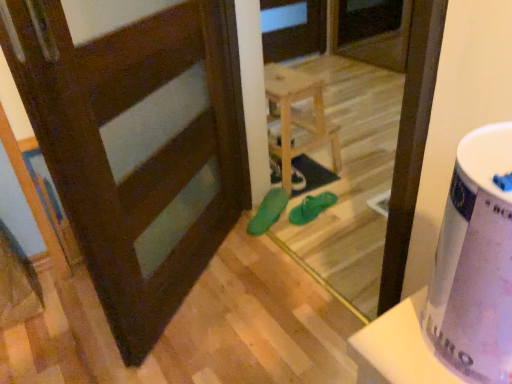
You are a GUI agent. You are given a task and a screenshot of the screen. Output one action in this format:
    pyautogui.click(x=<x>, y=<y>)
    Task: Click on the green rubber sandals at center, marked as the second footwear in a right-to-left arrangement
    
    Given the screenshot: What is the action you would take?
    pyautogui.click(x=268, y=211)

Locate an element on the screen. The width and height of the screenshot is (512, 384). green rubber sandals at center is located at coordinates (371, 169).

What are the coordinates of `dark brown wood door at center` in the screenshot? It's located at (145, 157).

What is the approximate height of matte green shoe at center?

matte green shoe at center is 2.54 inches in height.

I want to click on matte green shoe at center, so click(275, 170).

Locate an element on the screen. The height and width of the screenshot is (384, 512). green rubber sandals at center, marked as the second footwear in a right-to-left arrangement is located at coordinates (268, 211).

Does green rubber sandals at center, arranged as the 1th footwear when viewed from the left, lie in front of light wood stool at center?

That is True.

Is green rubber sandals at center, marked as the second footwear in a right-to-left arrangement, turned away from light wood stool at center?

green rubber sandals at center, marked as the second footwear in a right-to-left arrangement, does not have its back to light wood stool at center.

Considering the sizes of green rubber sandals at center, marked as the second footwear in a right-to-left arrangement, and light wood stool at center in the image, is green rubber sandals at center, marked as the second footwear in a right-to-left arrangement, wider or thinner than light wood stool at center?

green rubber sandals at center, marked as the second footwear in a right-to-left arrangement, is thinner than light wood stool at center.

How much distance is there between green rubber sandals at center, arranged as the 1th footwear when viewed from the left, and light wood stool at center?

12.32 inches.

Between green rubber sandals at center and light wood stool at center, which one has larger width?

light wood stool at center.

From a real-world perspective, which object stands above the other?

In real-world perspective, green rubber sandals at center is above.

Is green rubber sandals at center facing away from light wood stool at center?

green rubber sandals at center is not turned away from light wood stool at center.

Locate an element on the screen. furniture behind the green rubber sandals at center is located at coordinates (298, 117).

I want to click on shoe on the left of green rubber flip-flops at center, which is the first footwear from right to left, so click(x=275, y=170).

Can you tell me how much green rubber flip-flops at center, which is counted as the 2th footwear, starting from the left, and matte green shoe at center differ in facing direction?

24.9 degrees.

Is green rubber flip-flops at center, which is the first footwear from right to left, facing towards matte green shoe at center?

No, green rubber flip-flops at center, which is the first footwear from right to left, is not turned towards matte green shoe at center.

Is point (298, 222) positioned after point (301, 180)?

No.

Considering the positions of point (66, 135) and point (307, 193), is point (66, 135) closer or farther from the camera than point (307, 193)?

Clearly, point (66, 135) is closer to the camera than point (307, 193).

Considering the sizes of objects dark brown wood door at center and green rubber sandals at center in the image provided, who is wider, dark brown wood door at center or green rubber sandals at center?

Wider between the two is dark brown wood door at center.

Is dark brown wood door at center positioned far away from green rubber sandals at center?

Actually, dark brown wood door at center and green rubber sandals at center are a little close together.

How different are the orientations of dark brown wood door at center and green rubber sandals at center in degrees?

125 degrees.

The height and width of the screenshot is (384, 512). Find the location of `the 2nd footwear to the right of the dark brown wood door at center, starting your count from the anchor`. the 2nd footwear to the right of the dark brown wood door at center, starting your count from the anchor is located at coordinates (311, 208).

Considering the relative sizes of dark brown wood door at center and green rubber flip-flops at center, which is counted as the 2th footwear, starting from the left, in the image provided, is dark brown wood door at center smaller than green rubber flip-flops at center, which is counted as the 2th footwear, starting from the left,?

A: No, dark brown wood door at center is not smaller than green rubber flip-flops at center, which is counted as the 2th footwear, starting from the left.

Is dark brown wood door at center looking in the opposite direction of green rubber flip-flops at center, which is the first footwear from right to left?

No, dark brown wood door at center is not facing the opposite direction of green rubber flip-flops at center, which is the first footwear from right to left.

Is green rubber flip-flops at center, which is the first footwear from right to left, completely or partially inside dark brown wood door at center?

Definitely not — green rubber flip-flops at center, which is the first footwear from right to left, is not inside dark brown wood door at center.

Is green rubber sandals at center facing away from green rubber sandals at center, arranged as the 1th footwear when viewed from the left?

Yes, green rubber sandals at center is positioned with its back facing green rubber sandals at center, arranged as the 1th footwear when viewed from the left.

Considering the relative sizes of green rubber sandals at center and green rubber sandals at center, arranged as the 1th footwear when viewed from the left, in the image provided, is green rubber sandals at center shorter than green rubber sandals at center, arranged as the 1th footwear when viewed from the left,?

Incorrect, the height of green rubber sandals at center does not fall short of that of green rubber sandals at center, arranged as the 1th footwear when viewed from the left.

Are green rubber sandals at center and green rubber sandals at center, arranged as the 1th footwear when viewed from the left, beside each other?

No, green rubber sandals at center is not with green rubber sandals at center, arranged as the 1th footwear when viewed from the left.

Which is in front, point (360, 202) or point (262, 224)?

The point (262, 224) is closer to the camera.

Considering the positions of objects green rubber flip-flops at center, which is counted as the 2th footwear, starting from the left, and white glossy potty at right in the image provided, who is more to the right, green rubber flip-flops at center, which is counted as the 2th footwear, starting from the left, or white glossy potty at right?

From the viewer's perspective, green rubber flip-flops at center, which is counted as the 2th footwear, starting from the left, appears more on the right side.

Considering the points (312, 214) and (466, 377), which point is in front, point (312, 214) or point (466, 377)?

Point (466, 377)

In the image, there is a white glossy potty at right. Identify the location of footwear above it (from the image's perspective). The height and width of the screenshot is (384, 512). (311, 208).

Where is `furniture above the green rubber sandals at center, marked as the second footwear in a right-to-left arrangement (from the image's perspective)`? Image resolution: width=512 pixels, height=384 pixels. furniture above the green rubber sandals at center, marked as the second footwear in a right-to-left arrangement (from the image's perspective) is located at coordinates (298, 117).

Locate an element on the screen. Image resolution: width=512 pixels, height=384 pixels. screen door below the light wood stool at center (from the image's perspective) is located at coordinates (371, 169).

Estimate the real-world distances between objects in this image. Which object is further from white glossy potty at right, green rubber flip-flops at center, which is counted as the 2th footwear, starting from the left, or green rubber sandals at center, arranged as the 1th footwear when viewed from the left?

green rubber flip-flops at center, which is counted as the 2th footwear, starting from the left, lies further to white glossy potty at right than the other object.

Estimate the real-world distances between objects in this image. Which object is further from light wood stool at center, white glossy potty at right or green rubber flip-flops at center, which is the first footwear from right to left?

Based on the image, white glossy potty at right appears to be further to light wood stool at center.

When comparing their distances from light wood stool at center, does dark brown wood door at center or green rubber sandals at center seem closer?

green rubber sandals at center is closer to light wood stool at center.

Which object lies further to the anchor point green rubber flip-flops at center, which is the first footwear from right to left, green rubber sandals at center, arranged as the 1th footwear when viewed from the left, or dark brown wood door at center?

The object further to green rubber flip-flops at center, which is the first footwear from right to left, is dark brown wood door at center.

From the picture: From the image, which object appears to be farther from light wood stool at center, green rubber sandals at center, arranged as the 1th footwear when viewed from the left, or white glossy potty at right?

Based on the image, white glossy potty at right appears to be further to light wood stool at center.

Looking at the image, which one is located further to white glossy potty at right, light wood stool at center or green rubber flip-flops at center, which is the first footwear from right to left?

light wood stool at center lies further to white glossy potty at right than the other object.

Based on their spatial positions, is matte green shoe at center or dark brown wood door at center further from light wood stool at center?

Based on the image, dark brown wood door at center appears to be further to light wood stool at center.

From the image, which object appears to be nearer to light wood stool at center, green rubber sandals at center, marked as the second footwear in a right-to-left arrangement, or green rubber sandals at center?

green rubber sandals at center, marked as the second footwear in a right-to-left arrangement, is positioned closer to the anchor light wood stool at center.

At what (x,y) coordinates should I click in order to perform the action: click on door between white glossy potty at right and green rubber sandals at center in the front-back direction. Please return your answer as a coordinate pair (x, y). This screenshot has width=512, height=384. Looking at the image, I should click on (145, 157).

Image resolution: width=512 pixels, height=384 pixels. What are the coordinates of `door located between white glossy potty at right and matte green shoe at center in the depth direction` in the screenshot? It's located at (145, 157).

Where is `screen door between dark brown wood door at center and green rubber flip-flops at center, which is the first footwear from right to left, along the z-axis`? The image size is (512, 384). screen door between dark brown wood door at center and green rubber flip-flops at center, which is the first footwear from right to left, along the z-axis is located at coordinates (371, 169).

The width and height of the screenshot is (512, 384). Find the location of `screen door between dark brown wood door at center and green rubber sandals at center, marked as the second footwear in a right-to-left arrangement, from front to back`. screen door between dark brown wood door at center and green rubber sandals at center, marked as the second footwear in a right-to-left arrangement, from front to back is located at coordinates (371, 169).